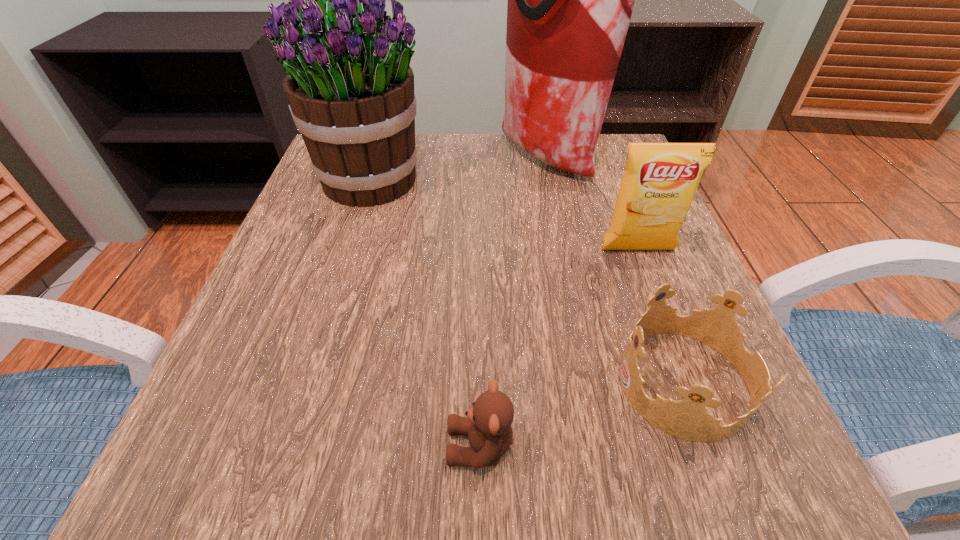
The width and height of the screenshot is (960, 540). I want to click on grocery bag, so click(570, 0).

Where is `the leftmost object`? Image resolution: width=960 pixels, height=540 pixels. the leftmost object is located at coordinates (350, 89).

You are a GUI agent. You are given a task and a screenshot of the screen. Output one action in this format:
    pyautogui.click(x=<x>, y=<y>)
    Task: Click on the bouquet
    
    Given the screenshot: What is the action you would take?
    pyautogui.click(x=350, y=89)

The width and height of the screenshot is (960, 540). I want to click on crisp (potato chip), so click(x=660, y=180).

You are a GUI agent. You are given a task and a screenshot of the screen. Output one action in this format:
    pyautogui.click(x=<x>, y=<y>)
    Task: Click on the third shortest object
    
    Given the screenshot: What is the action you would take?
    pyautogui.click(x=660, y=180)

Image resolution: width=960 pixels, height=540 pixels. Find the location of `tiara`. tiara is located at coordinates (687, 419).

The width and height of the screenshot is (960, 540). Identify the location of teddy bear. (488, 423).

You are a GUI agent. You are given a task and a screenshot of the screen. Output one action in this format:
    pyautogui.click(x=<x>, y=<y>)
    Task: Click on the vacant position located 0.380m on the front of the grocery bag
    Image resolution: width=960 pixels, height=540 pixels.
    Given the screenshot: What is the action you would take?
    pyautogui.click(x=580, y=322)

Where is `vacant space located on the right of the second tallest object`? The image size is (960, 540). vacant space located on the right of the second tallest object is located at coordinates (566, 181).

Where is `vacant space located on the front of the third nearest object with the logo`? vacant space located on the front of the third nearest object with the logo is located at coordinates (694, 398).